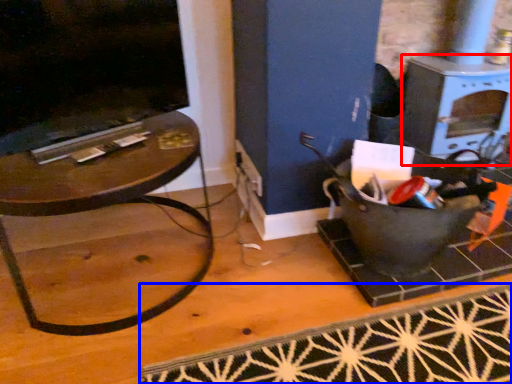
Question: Which object appears farthest to the camera in this image, stove (highlighted by a red box) or doormat (highlighted by a blue box)?

Choices:
 (A) stove
 (B) doormat

Answer: (A)